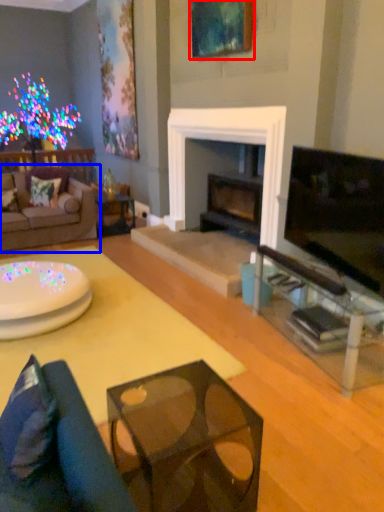
Question: Among these objects, which one is nearest to the camera, picture frame (highlighted by a red box) or studio couch (highlighted by a blue box)?

Choices:
 (A) picture frame
 (B) studio couch

Answer: (A)